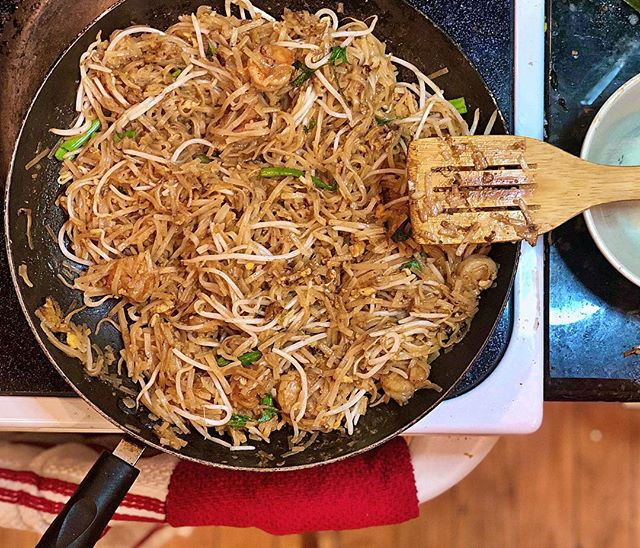
Find the location of a particular element. This screenshot has width=640, height=548. oven door handle is located at coordinates (463, 467).